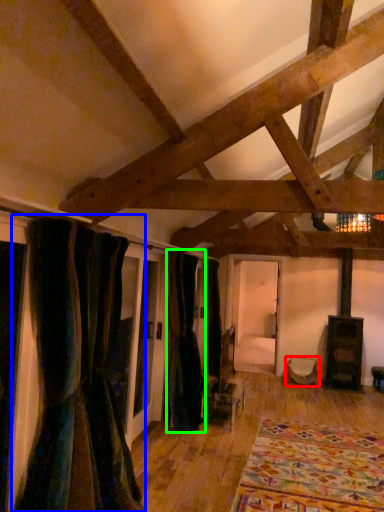
Question: Estimate the real-world distances between objects in this image. Which object is closer to furniture (highlighted by a red box), curtain (highlighted by a blue box) or curtain (highlighted by a green box)?

Choices:
 (A) curtain
 (B) curtain

Answer: (B)